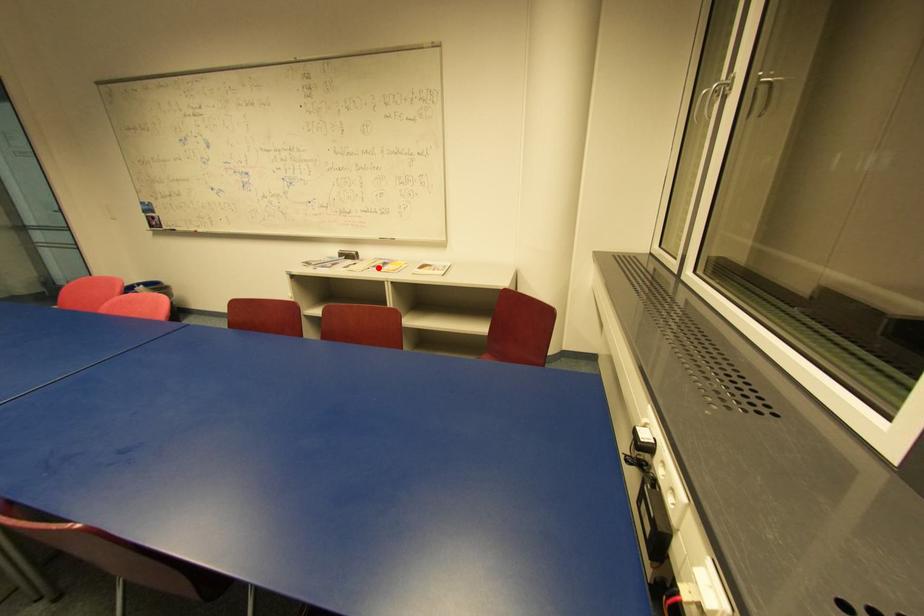
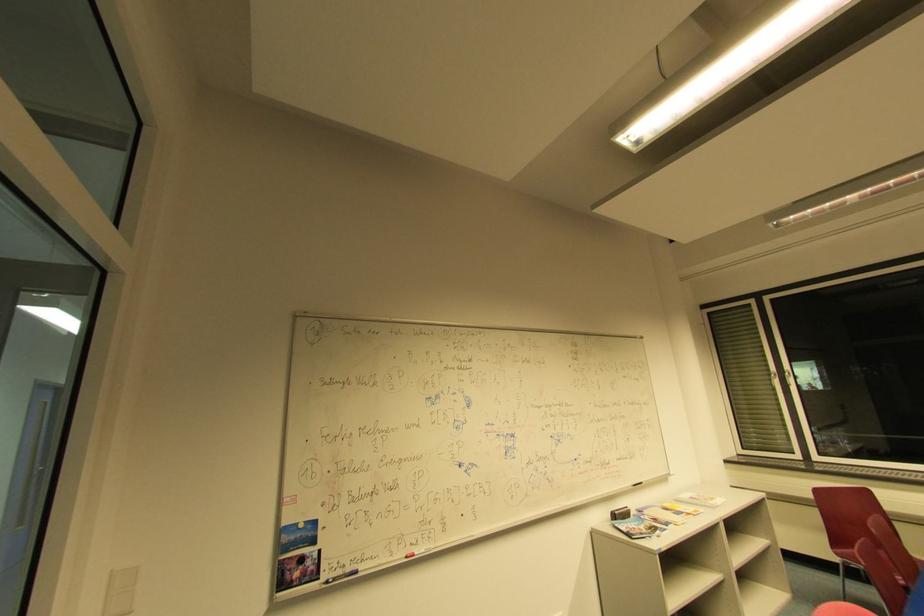
Where in the second image is the point corresponding to the highlighted location from the first image?

(679, 515)